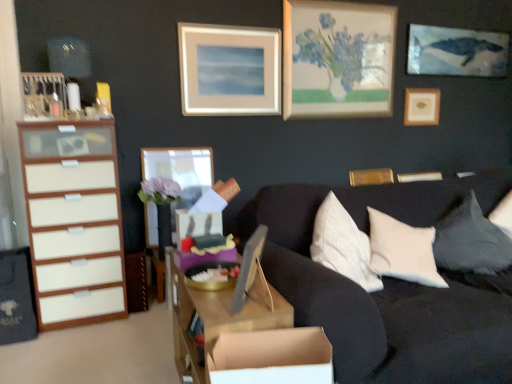
Question: Which direction should I rotate to face wooden picture frame at center, the 1th picture frame from the front, — up or down?

Choices:
 (A) up
 (B) down

Answer: (B)

Question: From the image's perspective, is wooden desk at center under gold metallic picture frame at upper right, which is the 4th picture frame in front-to-back order?

Choices:
 (A) yes
 (B) no

Answer: (A)

Question: Does wooden desk at center lie in front of gold metallic picture frame at upper right, the 2th picture frame positioned from the right?

Choices:
 (A) no
 (B) yes

Answer: (B)

Question: Are wooden desk at center and gold metallic picture frame at upper right, positioned as the 4th picture frame in left-to-right order, far apart?

Choices:
 (A) no
 (B) yes

Answer: (B)

Question: Does wooden desk at center lie behind gold metallic picture frame at upper right, positioned as the 4th picture frame in left-to-right order?

Choices:
 (A) yes
 (B) no

Answer: (B)

Question: Does wooden desk at center appear on the left side of gold metallic picture frame at upper right, positioned as the 4th picture frame in left-to-right order?

Choices:
 (A) yes
 (B) no

Answer: (A)

Question: Can you confirm if wooden desk at center is positioned to the right of gold metallic picture frame at upper right, which is counted as the second picture frame, starting from the back?

Choices:
 (A) yes
 (B) no

Answer: (B)

Question: Are wooden desk at center and wooden picture frame at center, acting as the fourth picture frame starting from the back, far apart?

Choices:
 (A) no
 (B) yes

Answer: (B)

Question: Does wooden desk at center have a lesser width compared to wooden picture frame at center, which is the second picture frame from front to back?

Choices:
 (A) yes
 (B) no

Answer: (B)

Question: From a real-world perspective, is wooden desk at center located higher than wooden picture frame at center, acting as the fourth picture frame starting from the back?

Choices:
 (A) yes
 (B) no

Answer: (B)

Question: Does wooden desk at center have a greater height compared to wooden picture frame at center, arranged as the first picture frame when viewed from the left?

Choices:
 (A) yes
 (B) no

Answer: (B)

Question: Is wooden desk at center positioned beyond the bounds of wooden picture frame at center, arranged as the first picture frame when viewed from the left?

Choices:
 (A) no
 (B) yes

Answer: (B)

Question: Does wooden desk at center appear on the right side of wooden picture frame at center, arranged as the first picture frame when viewed from the left?

Choices:
 (A) yes
 (B) no

Answer: (A)

Question: Considering the relative positions of wooden picture frame at center, acting as the 5th picture frame starting from the back, and wooden picture frame at center, acting as the fourth picture frame starting from the back, in the image provided, is wooden picture frame at center, acting as the 5th picture frame starting from the back, to the right of wooden picture frame at center, acting as the fourth picture frame starting from the back, from the viewer's perspective?

Choices:
 (A) no
 (B) yes

Answer: (B)